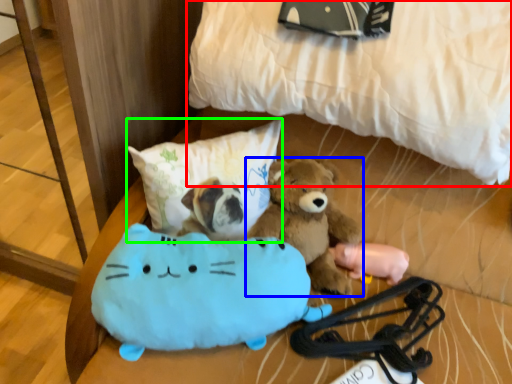
Question: Estimate the real-world distances between objects in this image. Which object is closer to bed (highlighted by a red box), teddy bear (highlighted by a blue box) or pillow (highlighted by a green box)?

Choices:
 (A) teddy bear
 (B) pillow

Answer: (B)